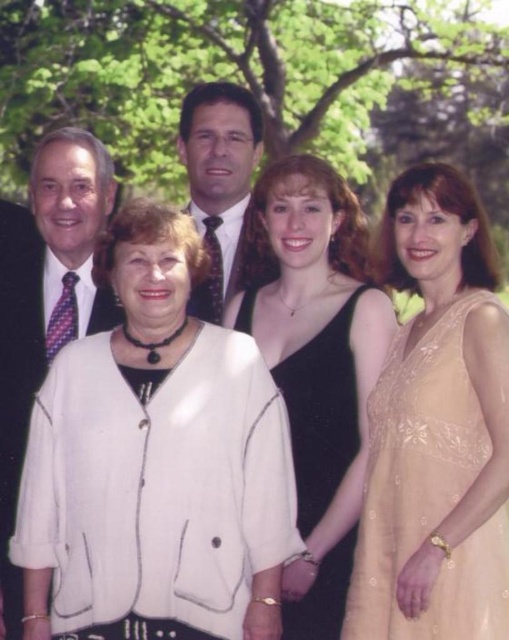
Question: Is white fabric jacket at center to the right of satin beige dress at right from the viewer's perspective?

Choices:
 (A) no
 (B) yes

Answer: (A)

Question: Is matte black suit at left wider than black satin dress at center?

Choices:
 (A) yes
 (B) no

Answer: (A)

Question: Which point is farther to the camera?

Choices:
 (A) (95, 563)
 (B) (491, 301)
 (C) (179, 124)

Answer: (C)

Question: Can you confirm if white fabric jacket at center is wider than matte black suit at center?

Choices:
 (A) no
 (B) yes

Answer: (B)

Question: Which of these objects is positioned farthest from the satin beige dress at right?

Choices:
 (A) matte black suit at left
 (B) white fabric jacket at center

Answer: (A)

Question: Which point is farther to the camera?

Choices:
 (A) (80, 296)
 (B) (203, 164)

Answer: (B)